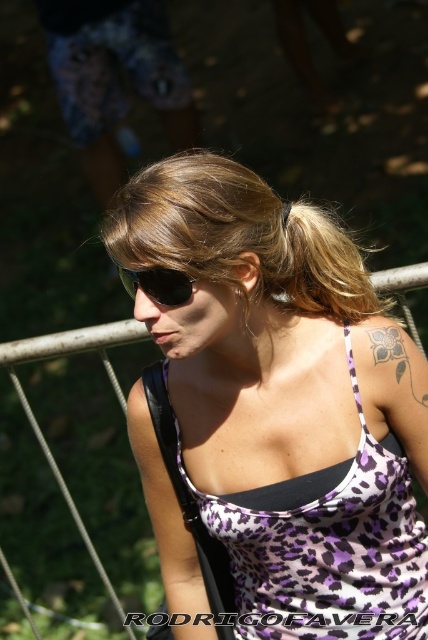
You are an artist trying to sketch the woman in the image. To ensure accuracy, you need to know the exact position of the purple leopard print tank top at center. What are the coordinates of its location?

The purple leopard print tank top at center is located at coordinates (281,403).

From the picture: The woman in the image is wearing a purple leopard print tank top at center and has blonde hair at center. Which of these has a greater width?

The purple leopard print tank top at center has a larger width than the blonde hair at center according to the description.

You are a photographer taking a portrait of the woman. You notice the blonde hair at center and the black plastic sunglasses at center. Which object is positioned to the right side of the other?

The blonde hair at center is to the right of the black plastic sunglasses at center.